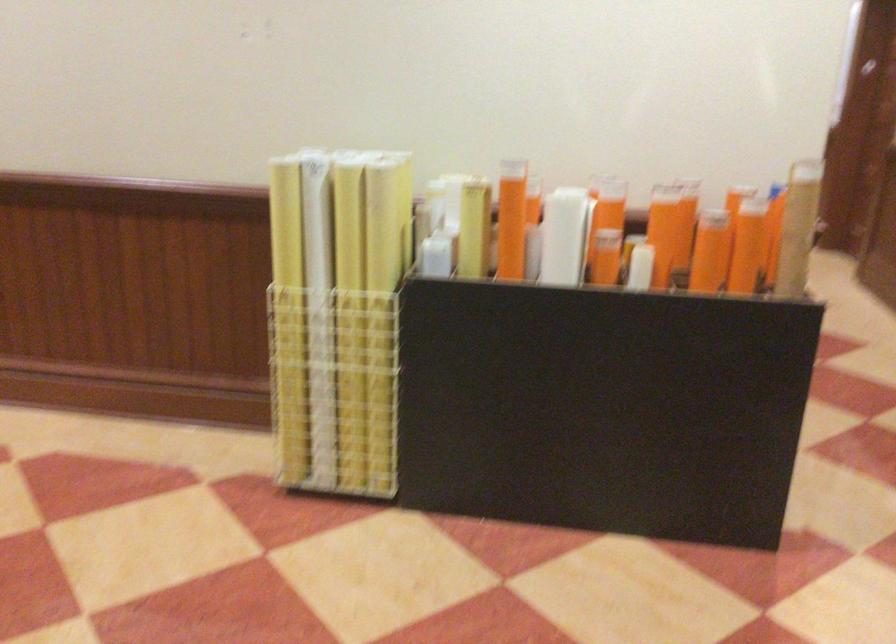
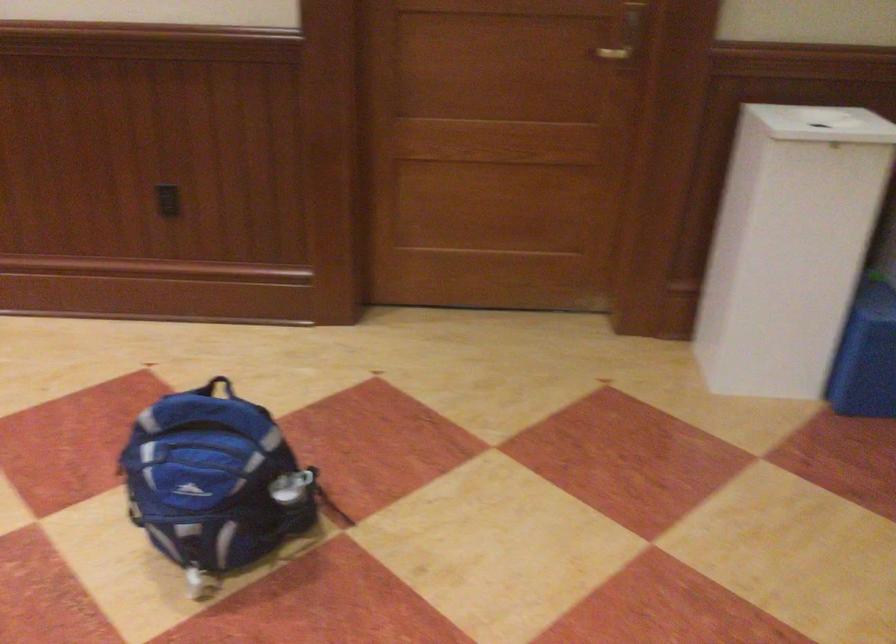
Based on the continuous images, in which direction is the camera rotating?

The rotation direction of the camera is right-down.